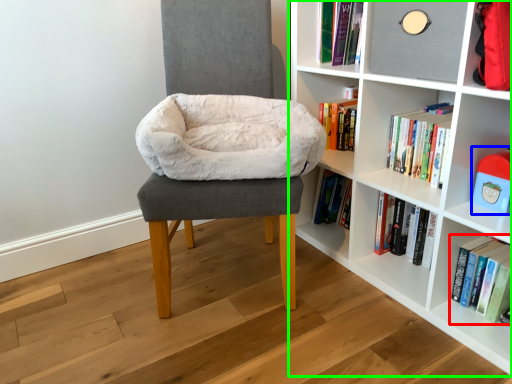
Question: Which is farther away from book (highlighted by a red box)? toy (highlighted by a blue box) or shelf (highlighted by a green box)?

Choices:
 (A) toy
 (B) shelf

Answer: (B)